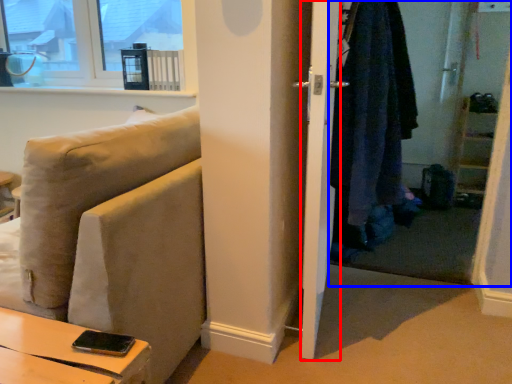
Question: Which object appears farthest to the camera in this image, screen door (highlighted by a red box) or closet (highlighted by a blue box)?

Choices:
 (A) screen door
 (B) closet

Answer: (B)